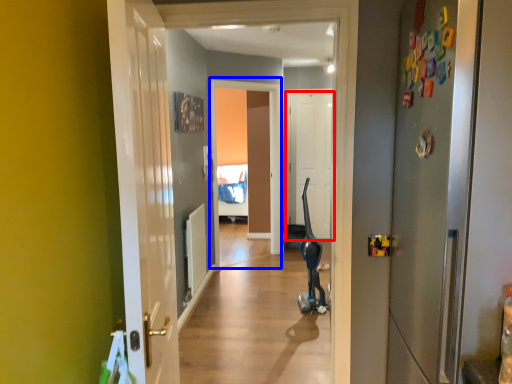
Question: Which point is closer to the camera, door (highlighted by a red box) or screen door (highlighted by a blue box)?

Choices:
 (A) door
 (B) screen door

Answer: (B)